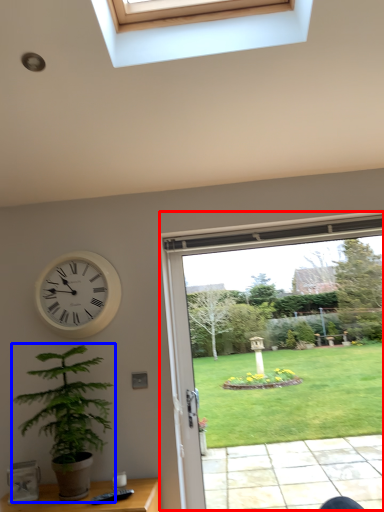
Question: Which of the following is the farthest to the observer, window (highlighted by a red box) or houseplant (highlighted by a blue box)?

Choices:
 (A) window
 (B) houseplant

Answer: (A)